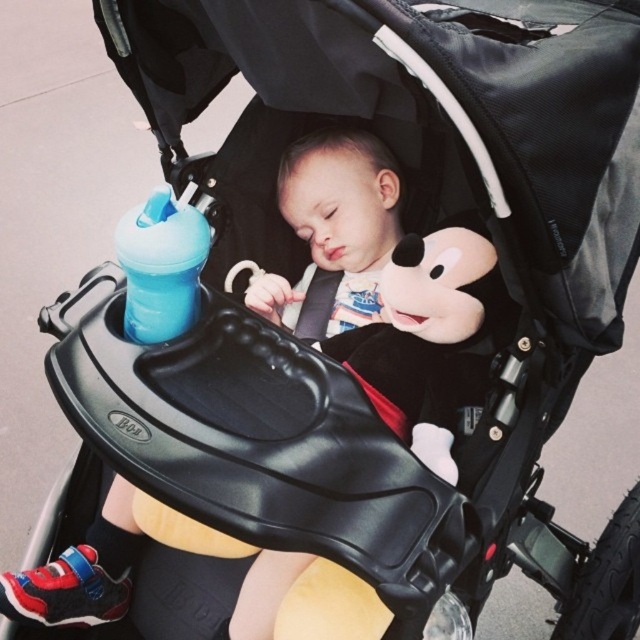
You are a parent trying to place a small toy between the soft plush mickey mouse at center and the blue plastic bottle at upper left. Which object should you move to make space?

The soft plush mickey mouse at center is wider than the blue plastic bottle at upper left, so you should move the soft plush mickey mouse at center to create space between them.

You are a parent trying to ensure the safety of your baby in the stroller. You need to place a small toy and a bottle in such a way that the taller item is closer to the baby to avoid falling. Given the soft plush mickey mouse at center and the blue plastic bottle at upper left, which item should be placed closer to the baby?

The soft plush mickey mouse at center is taller than the blue plastic bottle at upper left, so it should be placed closer to the baby to prevent it from tipping over.

Consider the image. You are a parent carrying a 15 inch bag and want to place it between the soft plush mickey mouse at center and the blue plastic bottle at upper left on the stroller tray. Will the bag fit in the space between them?

The distance between the soft plush mickey mouse at center and the blue plastic bottle at upper left is 16.07 inches. Since the bag is 15 inches long, it will fit in the space between them.